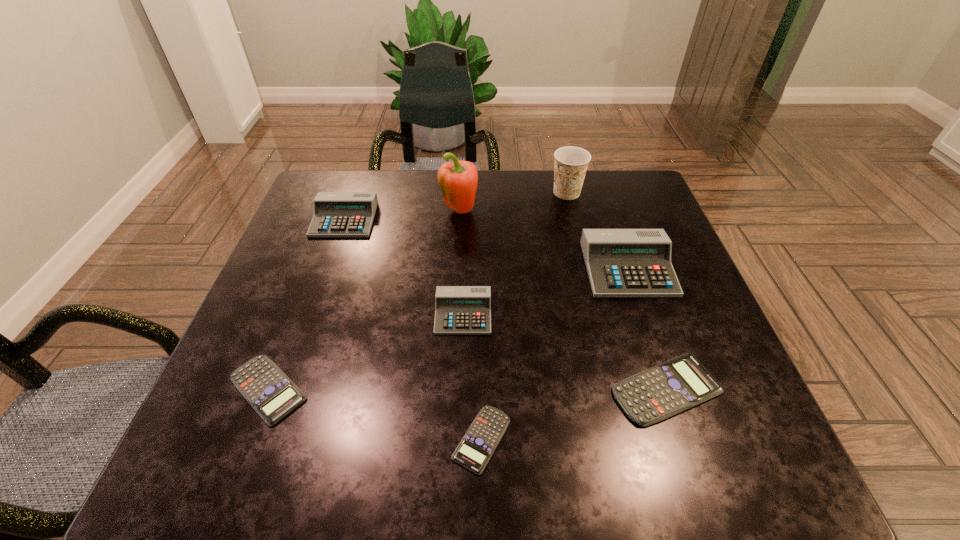
Where is `vacant space situated 0.240m on the front of the fifth tallest object`? Image resolution: width=960 pixels, height=540 pixels. vacant space situated 0.240m on the front of the fifth tallest object is located at coordinates (458, 451).

Image resolution: width=960 pixels, height=540 pixels. Identify the location of vacant region located 0.200m on the back of the sixth tallest object. (631, 282).

Image resolution: width=960 pixels, height=540 pixels. I want to click on free space located on the back of the leftmost blue calculator, so [x=314, y=271].

At what (x,y) coordinates should I click in order to perform the action: click on vacant position located on the left of the shortest calculator. Please return your answer as a coordinate pair (x, y). The image size is (960, 540). Looking at the image, I should click on (274, 439).

Identify the location of pepper located at the far edge. This screenshot has height=540, width=960. (458, 181).

The height and width of the screenshot is (540, 960). I want to click on Dixie cup positioned at the far edge, so click(571, 163).

You are a GUI agent. You are given a task and a screenshot of the screen. Output one action in this format:
    pyautogui.click(x=<x>, y=<y>)
    Task: Click on the calculator at the far edge
    The width and height of the screenshot is (960, 540).
    Given the screenshot: What is the action you would take?
    pyautogui.click(x=336, y=214)

At what (x,y) coordinates should I click in order to perform the action: click on object that is at the far left corner. Please return your answer as a coordinate pair (x, y). The height and width of the screenshot is (540, 960). Looking at the image, I should click on (336, 214).

The height and width of the screenshot is (540, 960). Find the location of `object situated at the near left corner`. object situated at the near left corner is located at coordinates (271, 393).

What are the coordinates of `object that is positioned at the near right corner` in the screenshot? It's located at (665, 390).